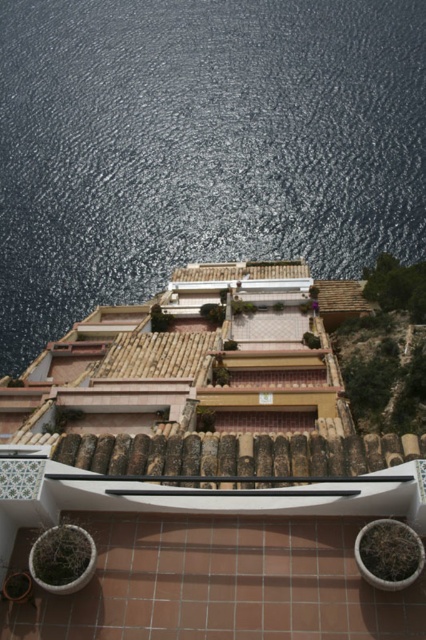
Can you confirm if glistening water at upper center is thinner than white glossy balcony at center?

No.

This screenshot has height=640, width=426. What do you see at coordinates (199, 145) in the screenshot?
I see `glistening water at upper center` at bounding box center [199, 145].

Locate an element on the screen. The image size is (426, 640). glistening water at upper center is located at coordinates (199, 145).